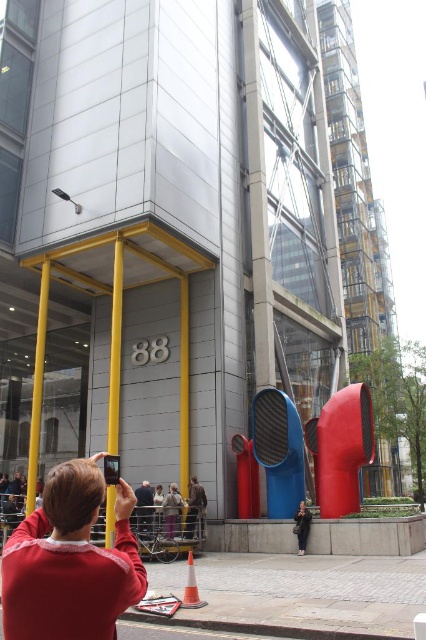
Question: Can you confirm if orange plastic traffic cone at lower center is positioned above dark gray jacket at center?

Choices:
 (A) no
 (B) yes

Answer: (B)

Question: Which point appears farthest from the camera in this image?

Choices:
 (A) (166, 532)
 (B) (46, 605)
 (C) (192, 564)
 (D) (307, 509)

Answer: (D)

Question: Which point is closer to the camera taking this photo?

Choices:
 (A) (175, 493)
 (B) (189, 570)
 (C) (302, 516)
 (D) (62, 566)

Answer: (D)

Question: Which of the following is the farthest from the observer?

Choices:
 (A) (189, 577)
 (B) (8, 540)
 (C) (298, 513)

Answer: (C)

Question: Can you confirm if orange plastic traffic cone at lower center is positioned to the left of dark gray jacket at center?

Choices:
 (A) no
 (B) yes

Answer: (B)

Question: Can you confirm if orange plastic traffic cone at lower center is positioned to the right of dark gray jacket at center?

Choices:
 (A) no
 (B) yes

Answer: (A)